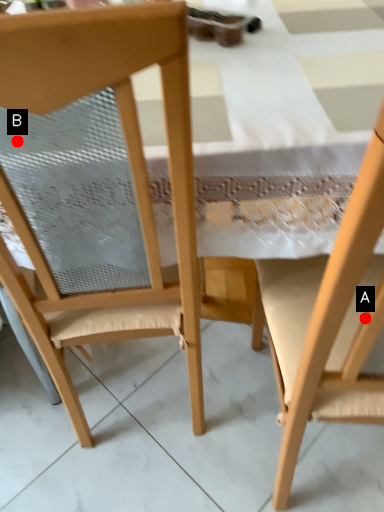
Question: Two points are circled on the image, labeled by A and B beside each circle. Which point is farther from the camera taking this photo?

Choices:
 (A) A is further
 (B) B is further

Answer: (B)